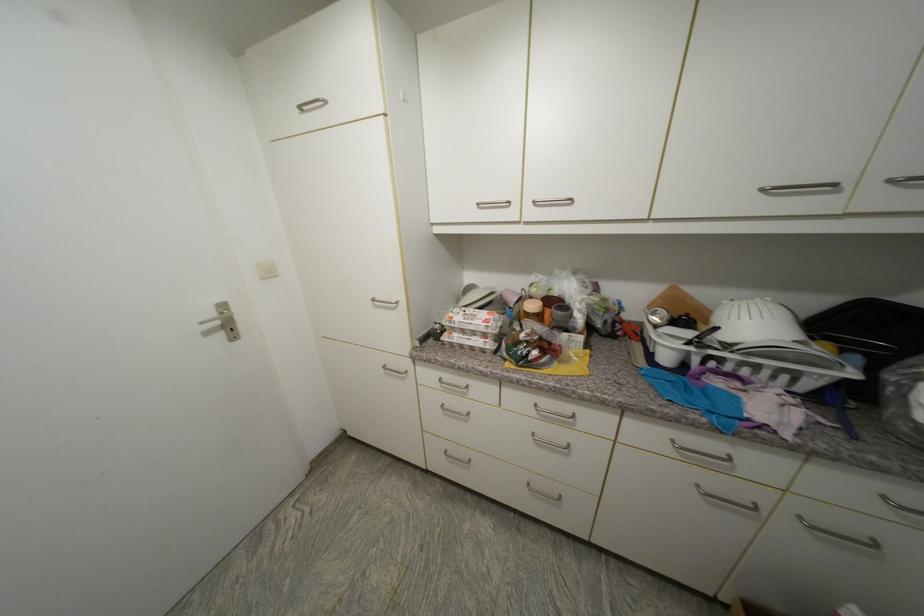
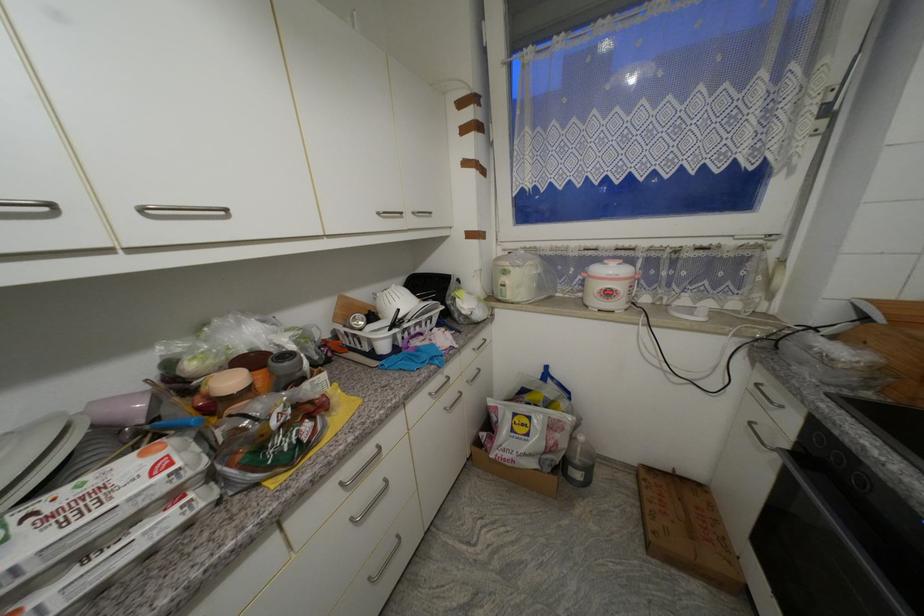
The point at [533,485] is marked in the first image. Where is the corresponding point in the second image?

(375, 581)